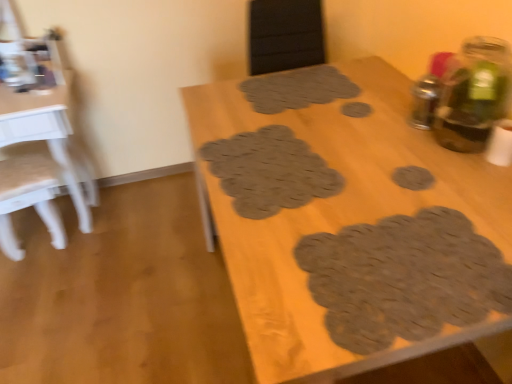
At what (x,y) coordinates should I click in order to perform the action: click on free point below brown textured mat at bottom right, which is the fifth footprint from back to front (from a real-world perspective). Please return your answer as a coordinate pair (x, y). Image resolution: width=512 pixels, height=384 pixels. Looking at the image, I should click on (404, 274).